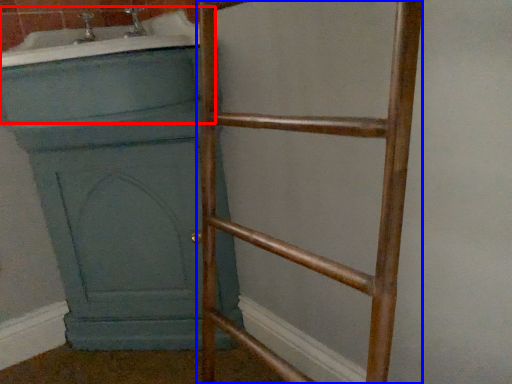
Question: Which object appears closest to the camera in this image, bath (highlighted by a red box) or ladder (highlighted by a blue box)?

Choices:
 (A) bath
 (B) ladder

Answer: (B)